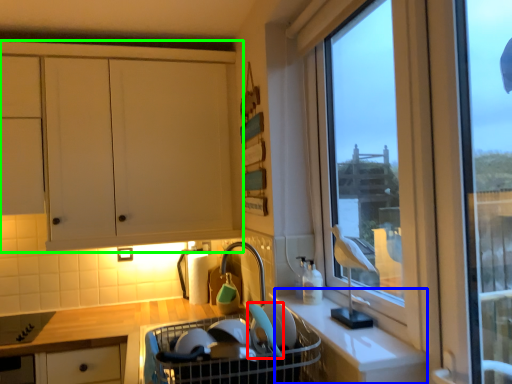
Question: Which is farther away from appliance (highlighted by a red box)? counter (highlighted by a blue box) or cabinetry (highlighted by a green box)?

Choices:
 (A) counter
 (B) cabinetry

Answer: (B)